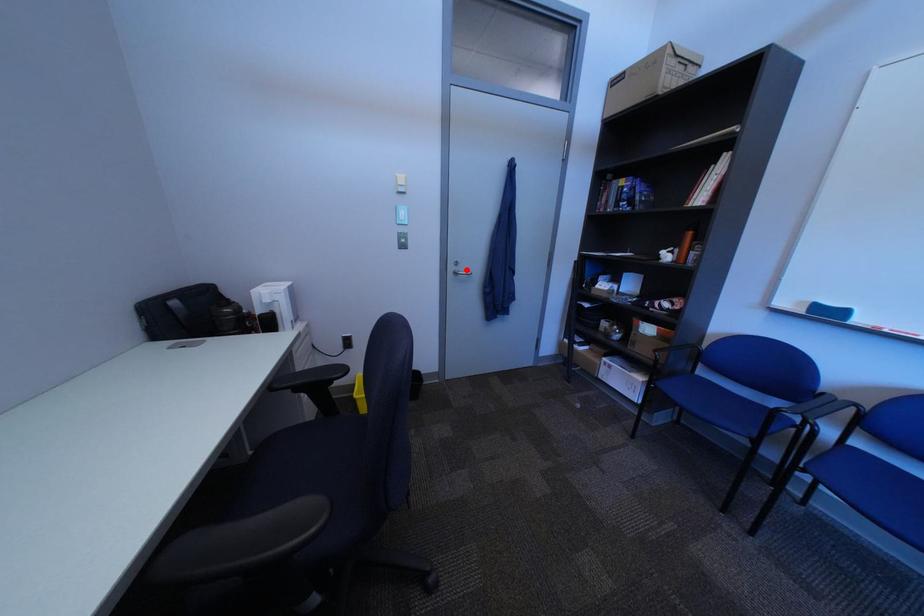
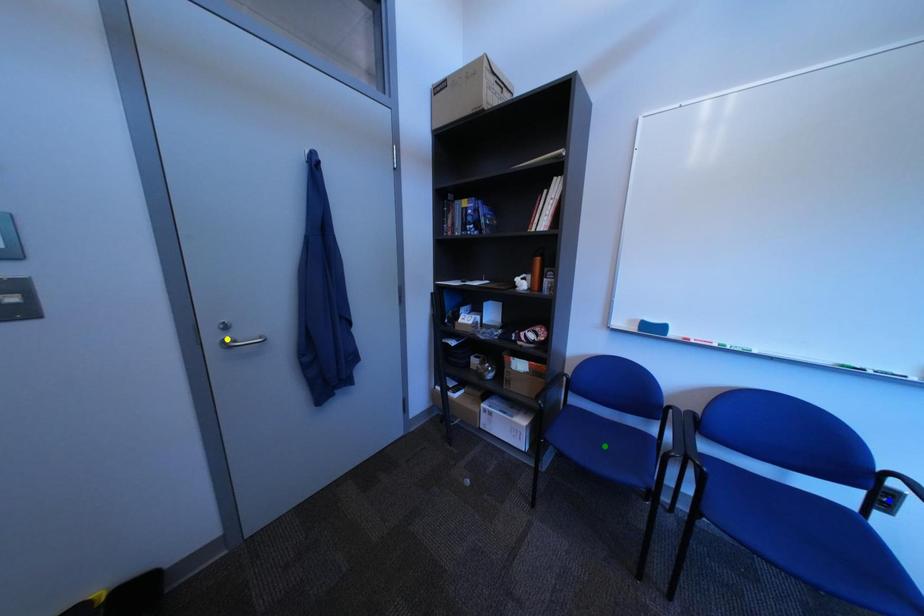
Question: I am providing you with two images of the same scene from different viewpoints. A red point is marked on the first image. You are given multiple points on the second image. Which point in image 2 represents the same 3d spot as the red point in image 1?

Choices:
 (A) blue point
 (B) green point
 (C) yellow point

Answer: (C)